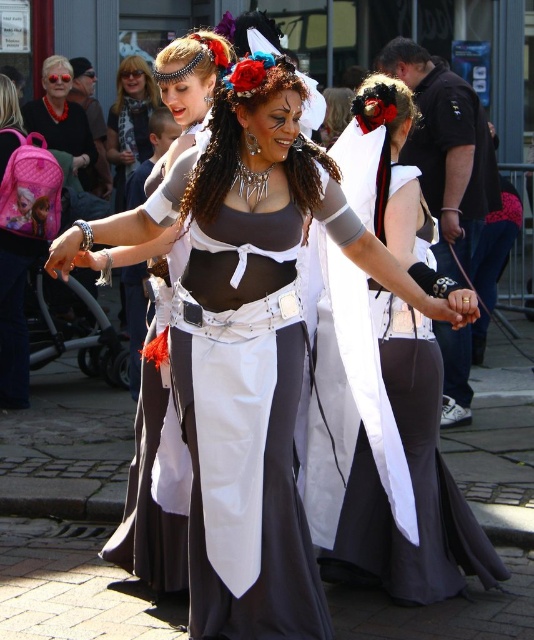
Question: Can you confirm if matte white dress at center is thinner than shiny silver necklace at center?

Choices:
 (A) no
 (B) yes

Answer: (B)

Question: Does white satin gloves at center appear under pink fabric backpack at upper left?

Choices:
 (A) yes
 (B) no

Answer: (A)

Question: Which object is closer to the camera taking this photo?

Choices:
 (A) matte white dress at center
 (B) white satin gloves at center
 (C) matte black hair at upper center

Answer: (A)

Question: Which object is the closest to the white satin gloves at center?

Choices:
 (A) pink fabric backpack at upper left
 (B) shiny silver necklace at center
 (C) matte black hair at upper center

Answer: (B)

Question: From the image, what is the correct spatial relationship of white satin apron at center in relation to white satin gloves at center?

Choices:
 (A) above
 (B) below

Answer: (B)

Question: Among these objects, which one is farthest from the camera?

Choices:
 (A) shiny silver necklace at center
 (B) white satin gloves at center
 (C) matte white dress at center
 (D) white satin apron at center

Answer: (B)